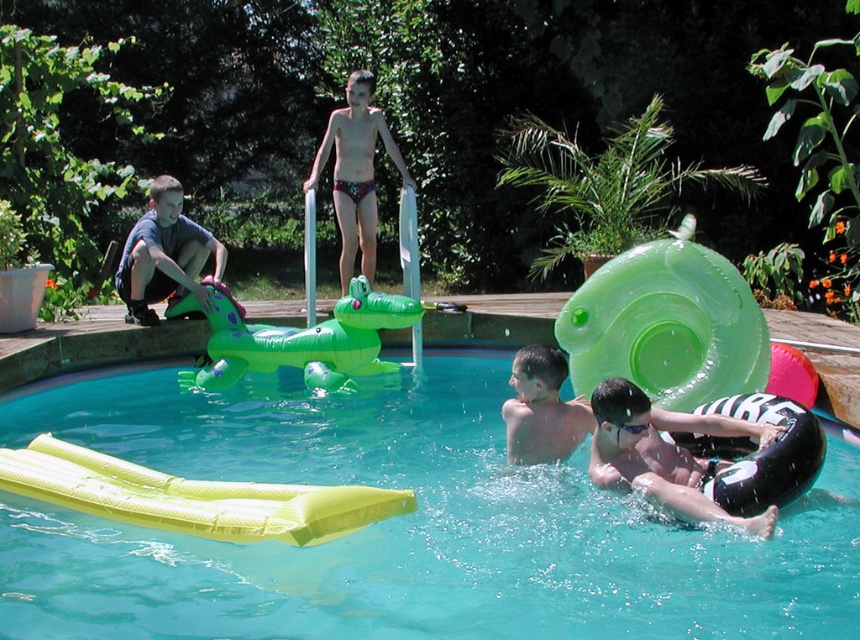
Question: Which object is farther from the camera taking this photo?

Choices:
 (A) matte green crocodile at left
 (B) smooth tan skin at lower center
 (C) green inflatable crocodile at center

Answer: (A)

Question: Can you confirm if green inflatable crocodile at center is positioned to the left of multicolored bikini at center?

Choices:
 (A) no
 (B) yes

Answer: (B)

Question: Does green inflatable crocodile at center have a larger size compared to smooth tan skin at lower center?

Choices:
 (A) no
 (B) yes

Answer: (B)

Question: Which point is farther from the camera taking this photo?

Choices:
 (A) (654, 493)
 (B) (544, 438)
 (C) (186, 296)

Answer: (C)

Question: In this image, where is matte green crocodile at left located relative to smooth tan skin at lower center?

Choices:
 (A) left
 (B) right

Answer: (A)

Question: Which object is positioned closest to the yellow inflatable at lower left?

Choices:
 (A) transparent yellow float at lower left
 (B) matte green crocodile at left

Answer: (A)